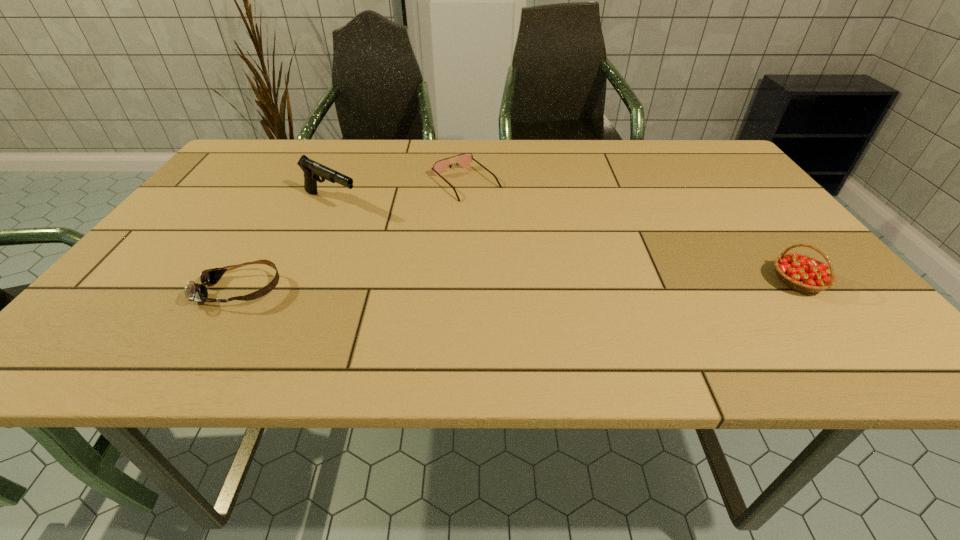
Identify the location of vacant region between the gun and the goggles. This screenshot has height=540, width=960. (286, 246).

This screenshot has height=540, width=960. I want to click on free space between the gun and the goggles, so click(x=286, y=246).

Locate an element on the screen. free area in between the sunglasses and the gun is located at coordinates (398, 192).

Locate an element on the screen. vacant region between the rightmost object and the goggles is located at coordinates (519, 286).

Locate an element on the screen. vacant space that's between the second object from right to left and the gun is located at coordinates (398, 192).

The image size is (960, 540). In order to click on empty space between the goggles and the rightmost object in this screenshot , I will do `click(519, 286)`.

Point out which object is positioned as the third nearest to the goggles. Please provide its 2D coordinates. Your answer should be formatted as a tuple, i.e. [(x, y)], where the tuple contains the x and y coordinates of a point satisfying the conditions above.

[(800, 272)]

Image resolution: width=960 pixels, height=540 pixels. I want to click on object that is the closest one to the tallest object, so click(464, 160).

Identify the location of blank area in the image that satisfies the following two spatial constraints: 1. on the front side of the tallest object; 2. on the left side of the strawberry. This screenshot has height=540, width=960. (295, 282).